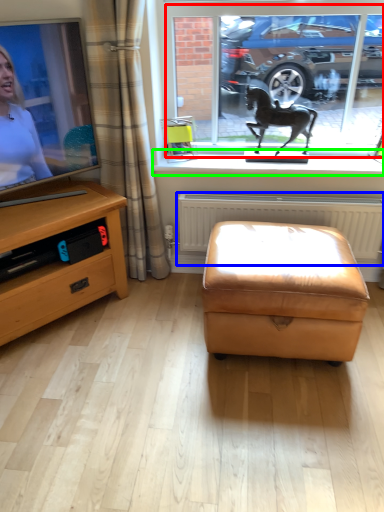
Question: Based on their relative distances, which object is farther from window frame (highlighted by a red box)? Choose from radiator (highlighted by a blue box) and window sill (highlighted by a green box).

Choices:
 (A) radiator
 (B) window sill

Answer: (A)